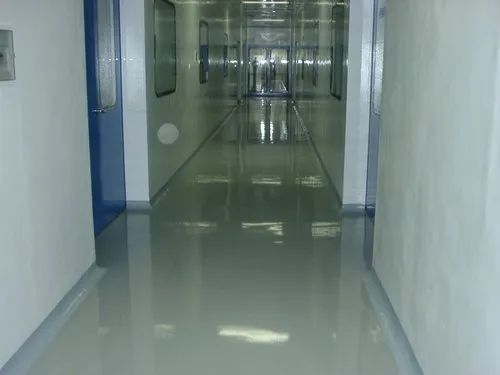
Image resolution: width=500 pixels, height=375 pixels. Find the location of `wall insert`. wall insert is located at coordinates (5, 54).